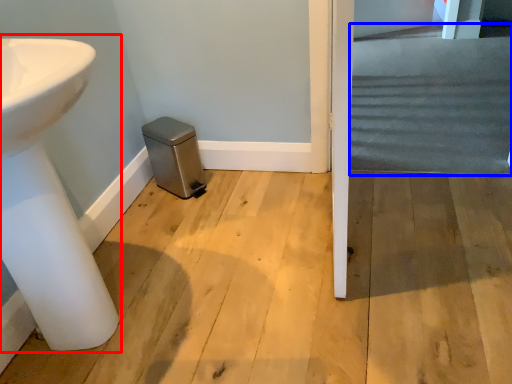
Question: Which object appears farthest to the camera in this image, sink (highlighted by a red box) or stairwell (highlighted by a blue box)?

Choices:
 (A) sink
 (B) stairwell

Answer: (B)